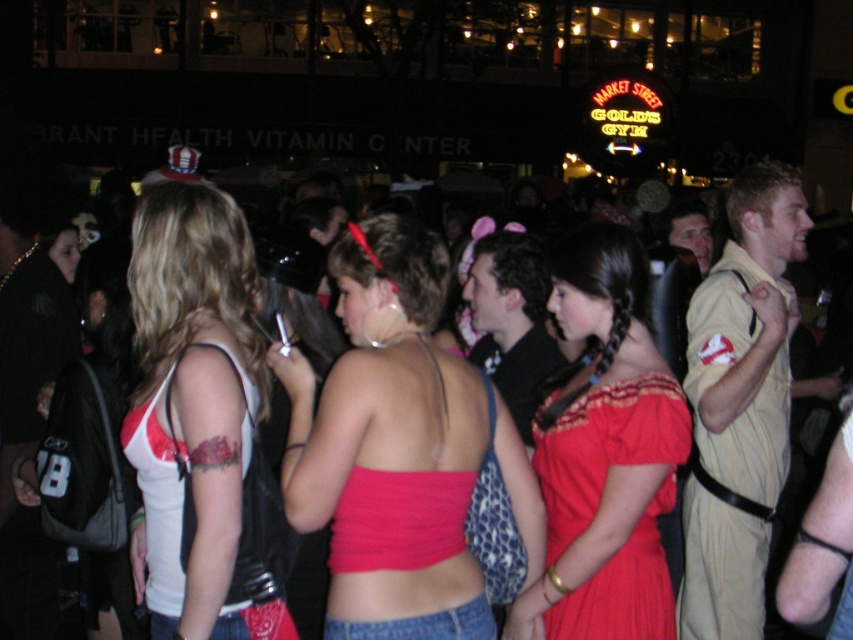
You are a photographer at the event and need to capture both the matte pink fabric top at center and the tan leather jacket at right in a single shot. Which object should you focus on first to ensure both are in frame?

The matte pink fabric top at center is much taller than the tan leather jacket at right, so focusing on the taller matte pink fabric top at center first will help ensure both are in frame.

You are at the event and want to identify two people wearing tops. The first person is wearing a matte pink fabric top at center and the second is wearing a white matte tank top at center. Which top is positioned lower on the person?

The matte pink fabric top at center is located below the white matte tank top at center, so the matte pink fabric top at center is positioned lower on the person.